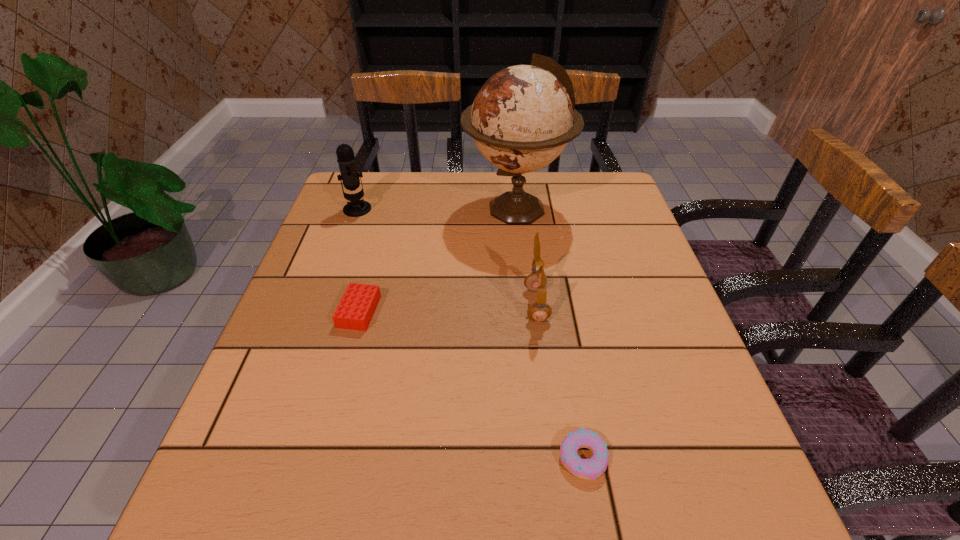
Locate an element on the screen. The image size is (960, 540). vacant space that satisfies the following two spatial constraints: 1. on the front of the globe showing Asia; 2. on the front side of the fourth tallest object is located at coordinates (527, 312).

Locate an element on the screen. free location that satisfies the following two spatial constraints: 1. on the front of the globe showing Asia; 2. on the back side of the shortest object is located at coordinates pos(542,457).

The width and height of the screenshot is (960, 540). Find the location of `vacant region that satisfies the following two spatial constraints: 1. on the front of the doughnut showing Asia; 2. on the right side of the globe`. vacant region that satisfies the following two spatial constraints: 1. on the front of the doughnut showing Asia; 2. on the right side of the globe is located at coordinates (542, 457).

Identify the location of free space that satisfies the following two spatial constraints: 1. on the front-facing side of the nearest object; 2. on the left side of the third shortest object. (556, 457).